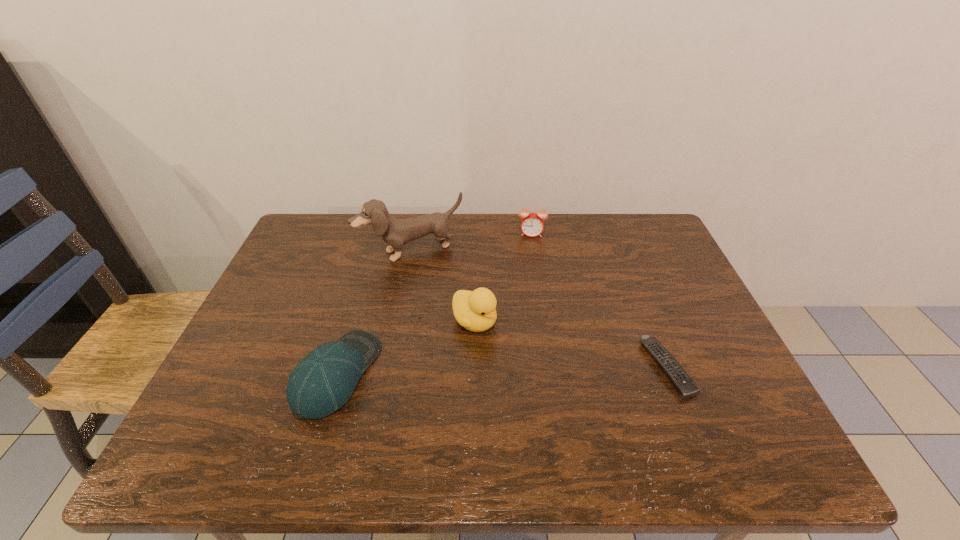
This screenshot has height=540, width=960. What are the coordinates of `remote control situated at the near edge` in the screenshot? It's located at (685, 386).

At what (x,y) coordinates should I click in order to perform the action: click on object at the right edge. Please return your answer as a coordinate pair (x, y). The height and width of the screenshot is (540, 960). Looking at the image, I should click on (685, 386).

Identify the location of object that is at the near right corner. The height and width of the screenshot is (540, 960). (685, 386).

The image size is (960, 540). In the image, there is a desktop. Find the location of `vacant space at the far edge`. vacant space at the far edge is located at coordinates (527, 259).

Identify the location of vacant space at the near edge. (292, 418).

Identify the location of free space at the left edge. The height and width of the screenshot is (540, 960). (313, 324).

Locate an element on the screen. The height and width of the screenshot is (540, 960). free space at the right edge is located at coordinates click(633, 267).

At what (x,y) coordinates should I click in order to perform the action: click on vacant area at the far left corner of the desktop. Please return your answer as a coordinate pair (x, y). Looking at the image, I should click on (302, 236).

The image size is (960, 540). In the image, there is a desktop. Find the location of `free space at the far right corner`. free space at the far right corner is located at coordinates (635, 242).

The image size is (960, 540). Identify the location of vacant space at the near right corner of the desktop. (732, 390).